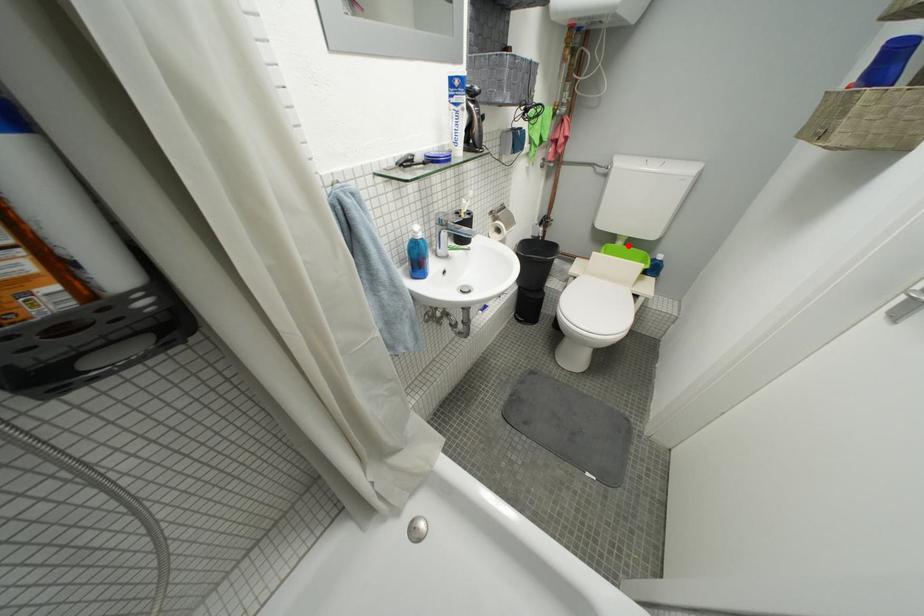
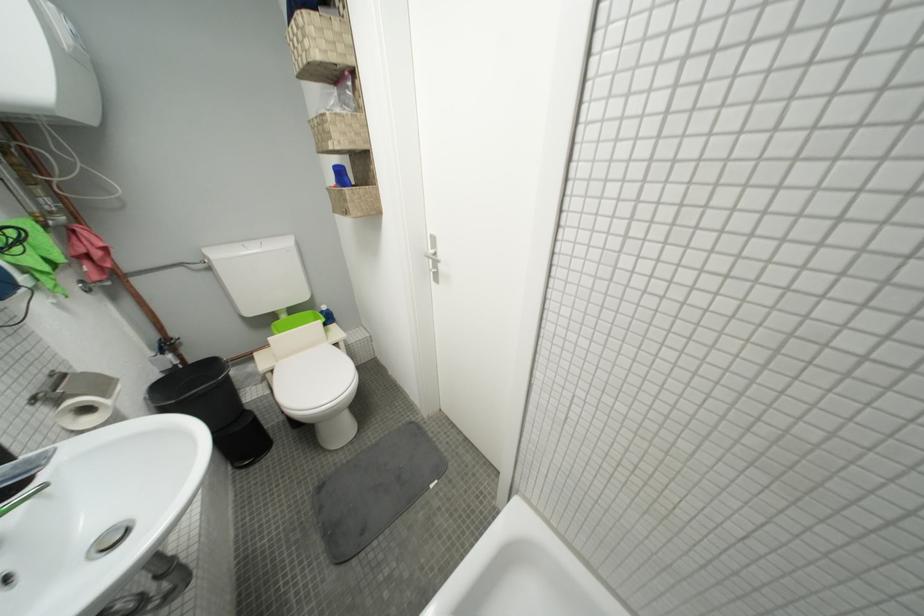
In the second image, find the point that corresponds to the highlighted location in the first image.

(293, 318)